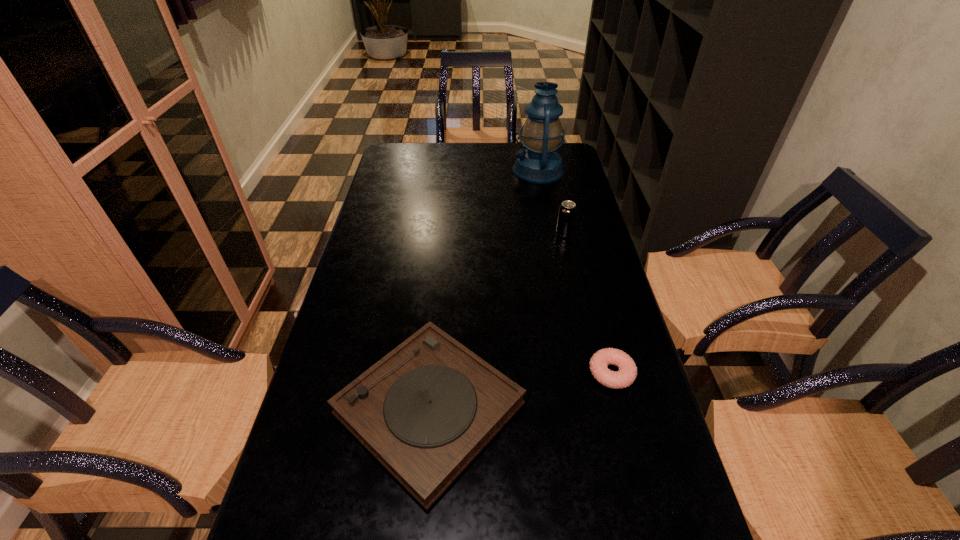
At what (x,y) coordinates should I click in order to perform the action: click on object that stands as the second closest to the third nearest object. Please return your answer as a coordinate pair (x, y). Looking at the image, I should click on (425, 410).

This screenshot has width=960, height=540. I want to click on object that is the second closest to the lantern, so pyautogui.click(x=425, y=410).

Where is `free space that satisfies the following two spatial constraints: 1. on the face of the lantern; 2. on the right side of the doughnut`? The height and width of the screenshot is (540, 960). free space that satisfies the following two spatial constraints: 1. on the face of the lantern; 2. on the right side of the doughnut is located at coordinates (577, 373).

Where is `free point that satisfies the following two spatial constraints: 1. on the face of the tallest object; 2. on the front side of the phonograph record`? free point that satisfies the following two spatial constraints: 1. on the face of the tallest object; 2. on the front side of the phonograph record is located at coordinates (584, 409).

At what (x,y) coordinates should I click in order to perform the action: click on free location that satisfies the following two spatial constraints: 1. on the back side of the shortest object; 2. on the right side of the phonograph record. Please return your answer as a coordinate pair (x, y). Looking at the image, I should click on 433,373.

The height and width of the screenshot is (540, 960). Identify the location of vacant region that satisfies the following two spatial constraints: 1. on the front side of the soda can; 2. on the left side of the shortest object. (596, 373).

Locate an element on the screen. free spot that satisfies the following two spatial constraints: 1. on the face of the tallest object; 2. on the left side of the third shortest object is located at coordinates [550, 233].

The image size is (960, 540). Find the location of `blank area in the image that satisfies the following two spatial constraints: 1. on the back side of the second farthest object; 2. on the left side of the phonograph record`. blank area in the image that satisfies the following two spatial constraints: 1. on the back side of the second farthest object; 2. on the left side of the phonograph record is located at coordinates (445, 233).

At what (x,y) coordinates should I click in order to perform the action: click on blank space that satisfies the following two spatial constraints: 1. on the face of the lantern; 2. on the left side of the doughnut. Please return your answer as a coordinate pair (x, y). The image size is (960, 540). Looking at the image, I should click on (577, 373).

Identify the location of vacant space that satisfies the following two spatial constraints: 1. on the face of the shortest object; 2. on the left side of the farthest object. (577, 373).